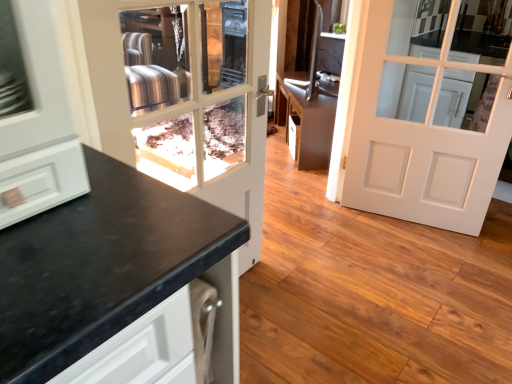
Where is `vacant area that is situated to the right of white matte door at center, placed as the second door when sorted from left to right`? Image resolution: width=512 pixels, height=384 pixels. vacant area that is situated to the right of white matte door at center, placed as the second door when sorted from left to right is located at coordinates (480, 237).